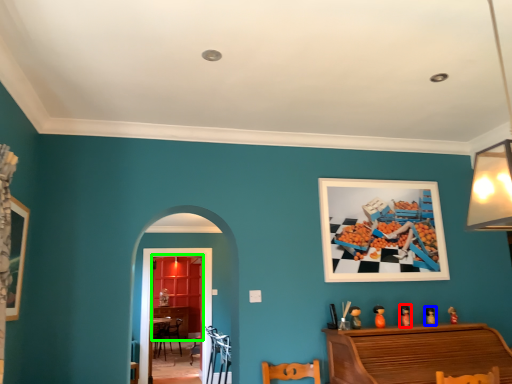
Question: Estimate the real-world distances between objects in this image. Which object is closer to toy (highlighted by a red box), toy (highlighted by a blue box) or dresser (highlighted by a green box)?

Choices:
 (A) toy
 (B) dresser

Answer: (A)